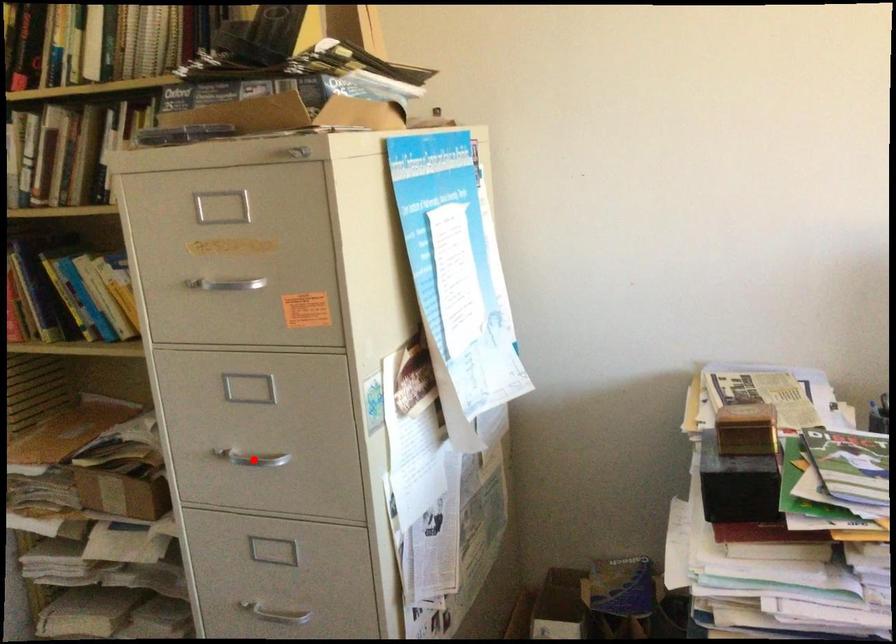
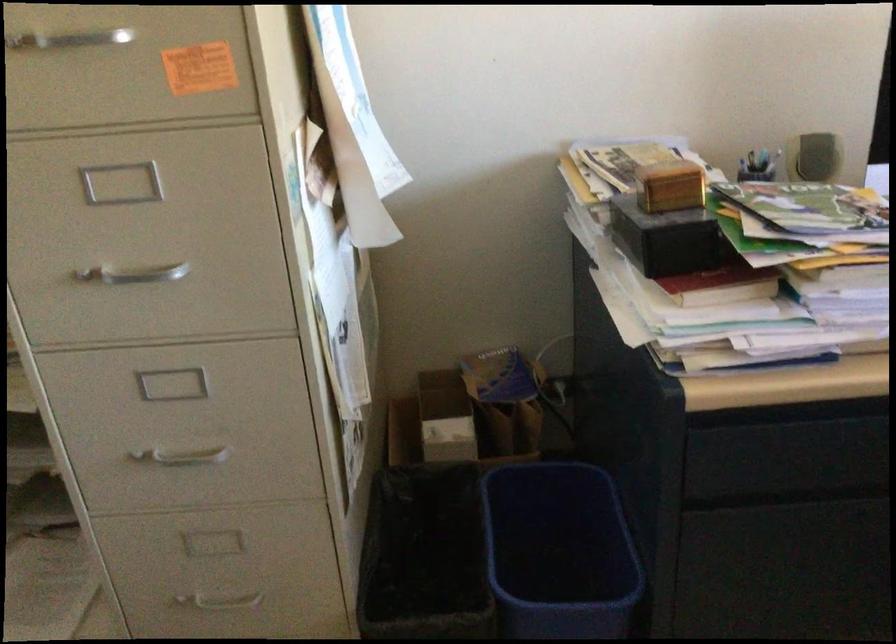
Question: I am providing you with two images of the same scene from different viewpoints. Image1 has a red point marked. In image2, the corresponding 3D location appears at what relative position? Reply with the corresponding letter.

Choices:
 (A) Closer
 (B) Farther

Answer: (A)